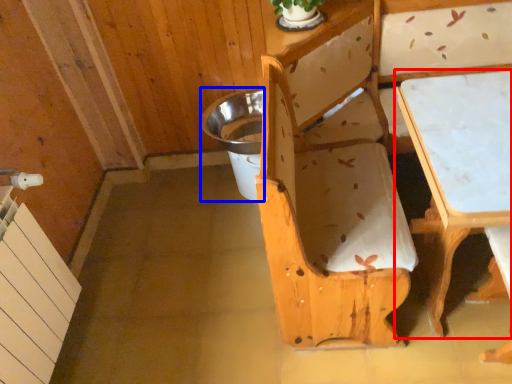
Question: Which object appears farthest to the camera in this image, table (highlighted by a red box) or potty (highlighted by a blue box)?

Choices:
 (A) table
 (B) potty

Answer: (B)